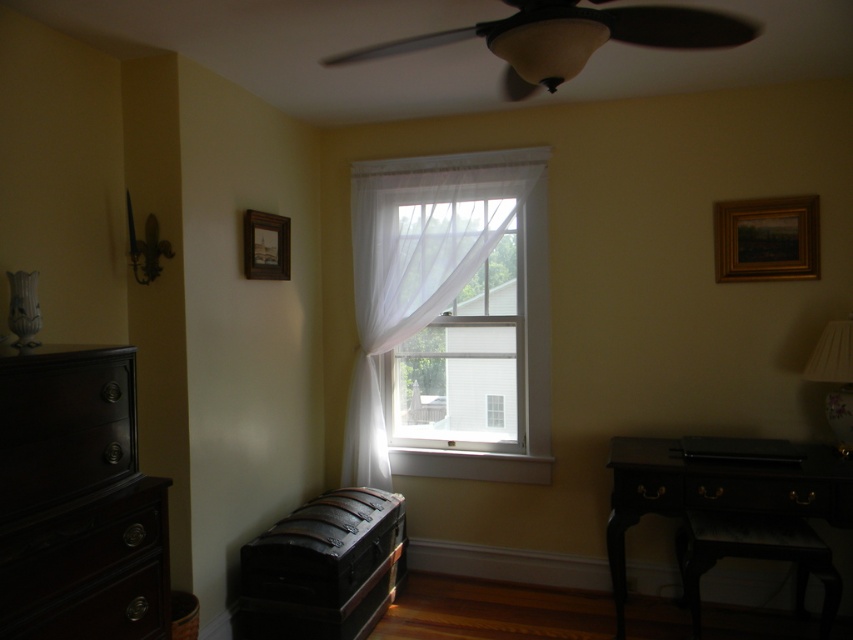
What is the spatial relationship between the black wood desk at lower right and the matte black drawer at right?

The black wood desk at lower right is positioned on the right side of the matte black drawer at right.

You are moving a 1.5 meter wide sofa into this room. You need to place it between the sheer white curtain at center and the dark wood drawer at left. Will there be enough space?

The sheer white curtain at center and dark wood drawer at left are 1.72 meters apart from each other. Since the sofa is 1.5 meters wide, there will be enough space to place it between them with 0.22 meters of clearance remaining.